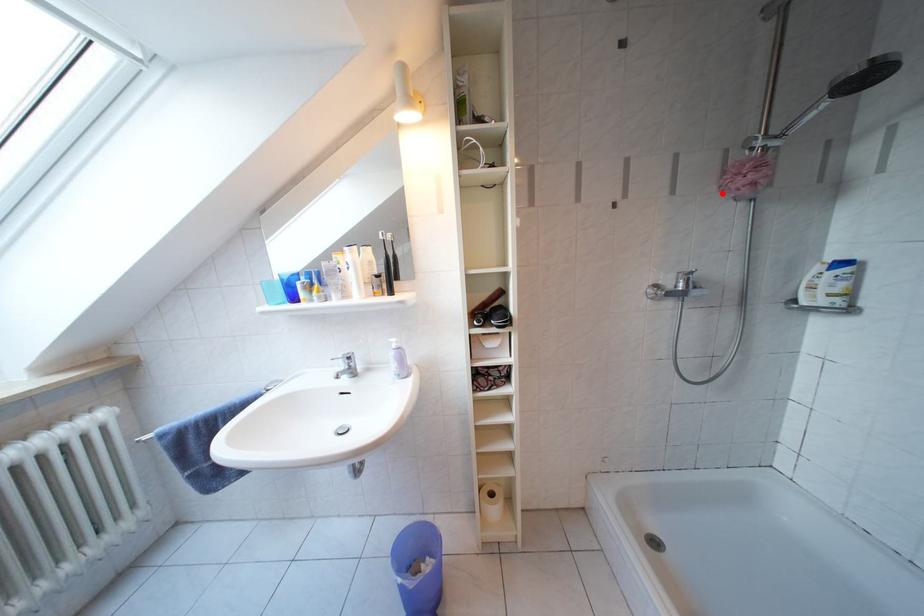
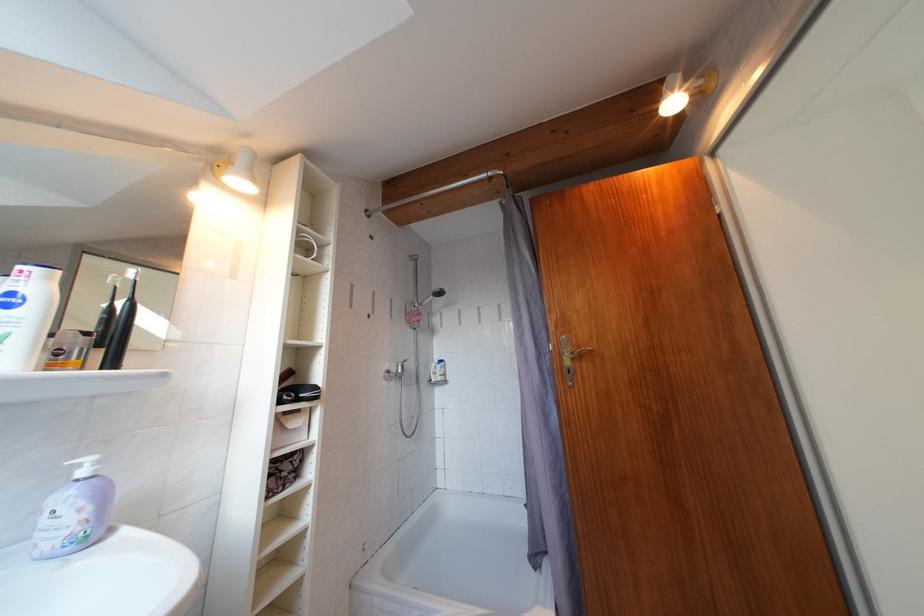
Locate, in the second image, the point that corresponds to the highlighted location in the first image.

(411, 325)